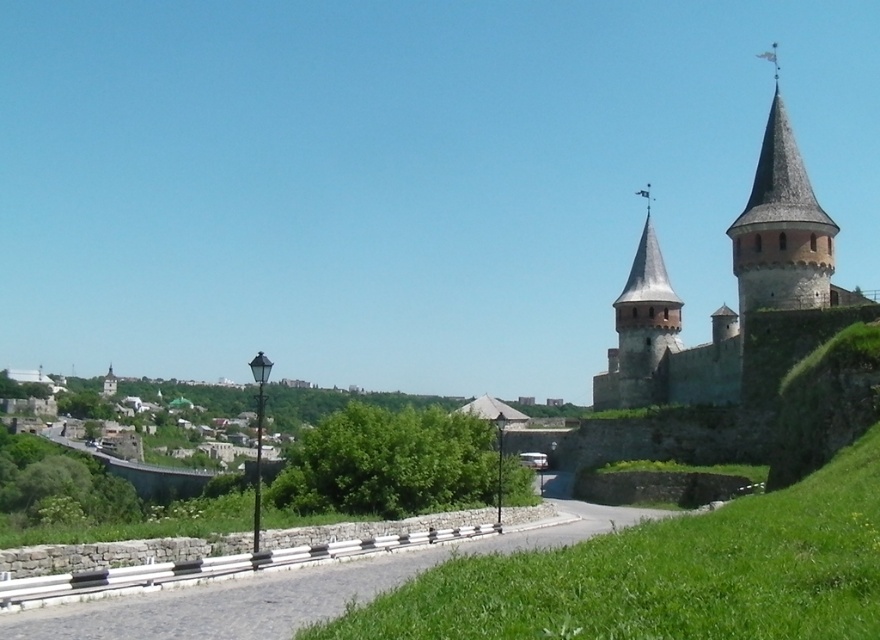
Is stone gray castle at upper right further to the viewer compared to gravel road at center?

That is True.

Does stone gray castle at upper right have a larger size compared to gravel road at center?

Indeed, stone gray castle at upper right has a larger size compared to gravel road at center.

Who is more distant from viewer, (786, 150) or (11, 624)?

Positioned behind is point (786, 150).

The width and height of the screenshot is (880, 640). I want to click on stone gray castle at upper right, so click(x=737, y=285).